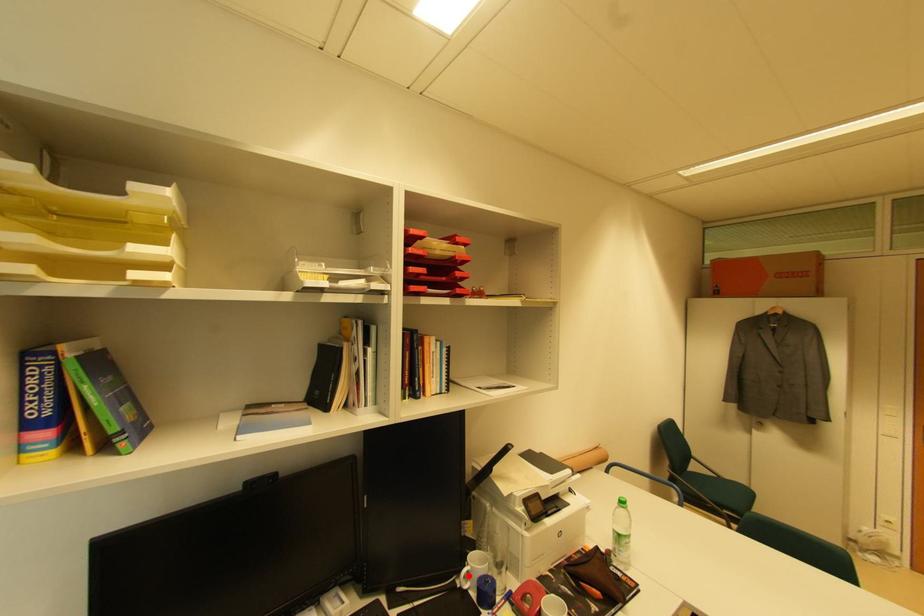
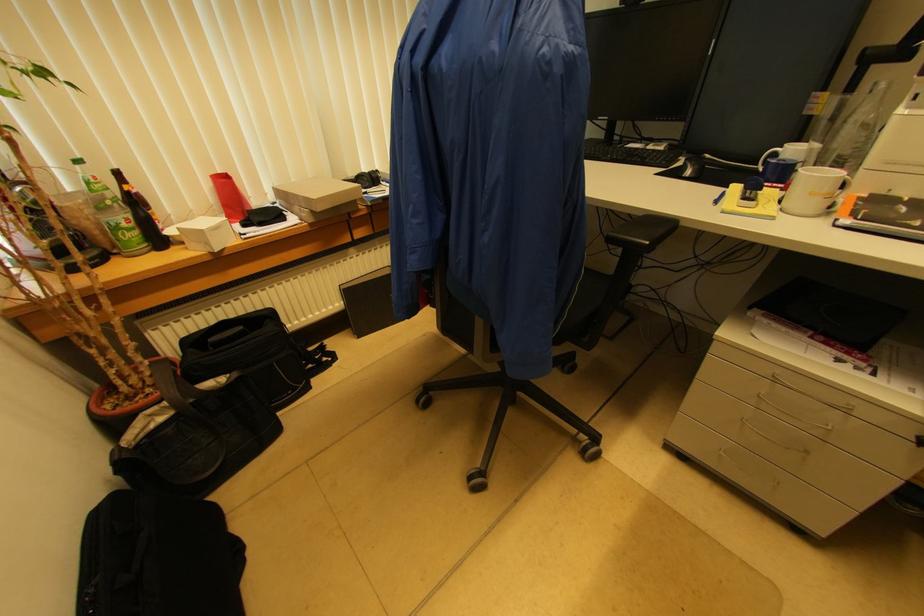
Where in the second image is the point corresponding to the highlighted location from the first image?

(775, 156)